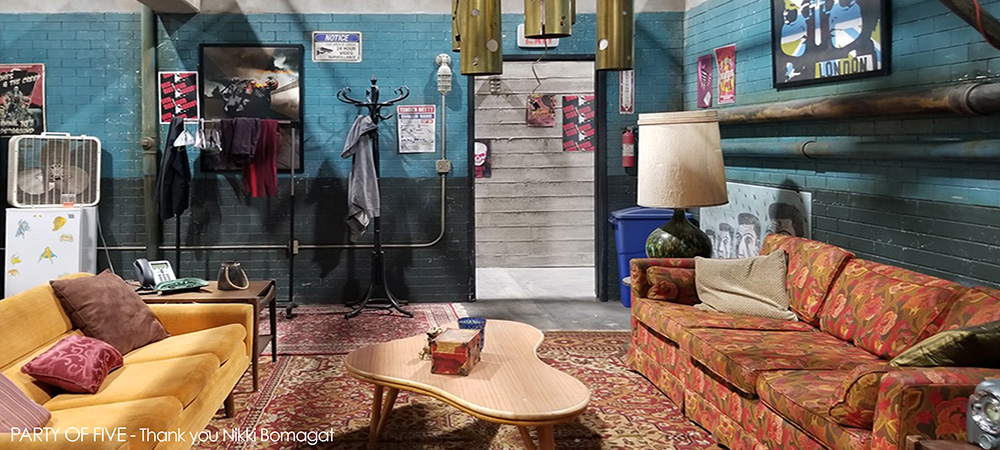
The height and width of the screenshot is (450, 1000). I want to click on yellow sofa, so click(x=136, y=369), click(x=195, y=344), click(x=107, y=409), click(x=25, y=325).